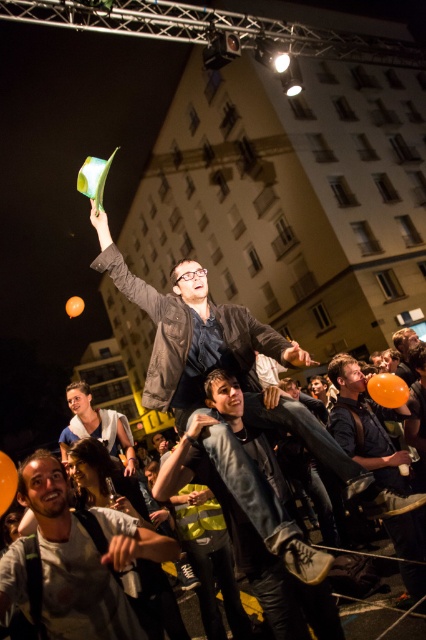
Who is positioned more to the right, matte black jacket at center or matte black shirt at lower right?

From the viewer's perspective, matte black shirt at lower right appears more on the right side.

Where is `matte black jacket at center`? The height and width of the screenshot is (640, 426). matte black jacket at center is located at coordinates pyautogui.click(x=192, y=332).

I want to click on matte black jacket at center, so click(x=192, y=332).

From the picture: Can you confirm if matte black jacket at center is thinner than orange matte balloon at lower left?

Incorrect, matte black jacket at center's width is not less than orange matte balloon at lower left's.

Can you confirm if matte black jacket at center is bigger than orange matte balloon at lower left?

Incorrect, matte black jacket at center is not larger than orange matte balloon at lower left.

In the scene shown: Who is more forward, (180,284) or (0,468)?

Point (0,468)

Locate an element on the screen. The image size is (426, 640). matte black jacket at center is located at coordinates (192, 332).

Does point (106, 228) lie in front of point (77, 305)?

Yes.

Which of these two, matte black jacket at center or orange matte balloon at upper center, stands shorter?

With less height is matte black jacket at center.

Does point (178, 323) lie in front of point (69, 300)?

Yes, it is.

The image size is (426, 640). I want to click on matte black jacket at center, so click(x=192, y=332).